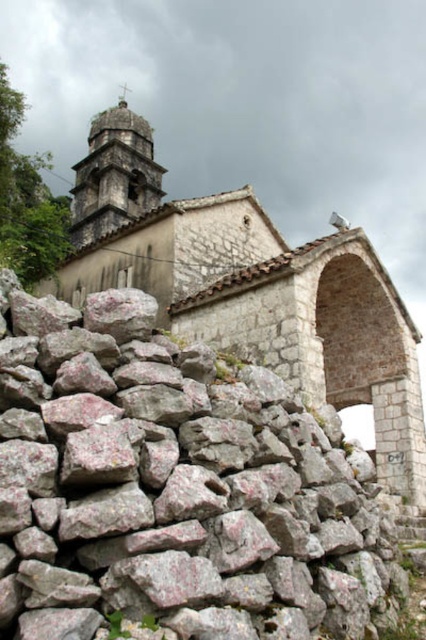
Question: Is pinkish-gray rough stone at center to the left of stone tower at upper center from the viewer's perspective?

Choices:
 (A) yes
 (B) no

Answer: (B)

Question: Can you confirm if pinkish-gray rough stone at center is positioned above light beige stone church at upper center?

Choices:
 (A) no
 (B) yes

Answer: (A)

Question: Can you confirm if light beige stone church at upper center is thinner than stone tower at upper center?

Choices:
 (A) no
 (B) yes

Answer: (A)

Question: Which point is closer to the camera?

Choices:
 (A) light beige stone church at upper center
 (B) stone tower at upper center

Answer: (A)

Question: Which point appears closest to the camera in this image?

Choices:
 (A) (152, 369)
 (B) (412, 428)
 (C) (106, 216)

Answer: (A)

Question: Among these points, which one is nearest to the camera?

Choices:
 (A) (92, 156)
 (B) (213, 212)
 (C) (77, 333)

Answer: (C)